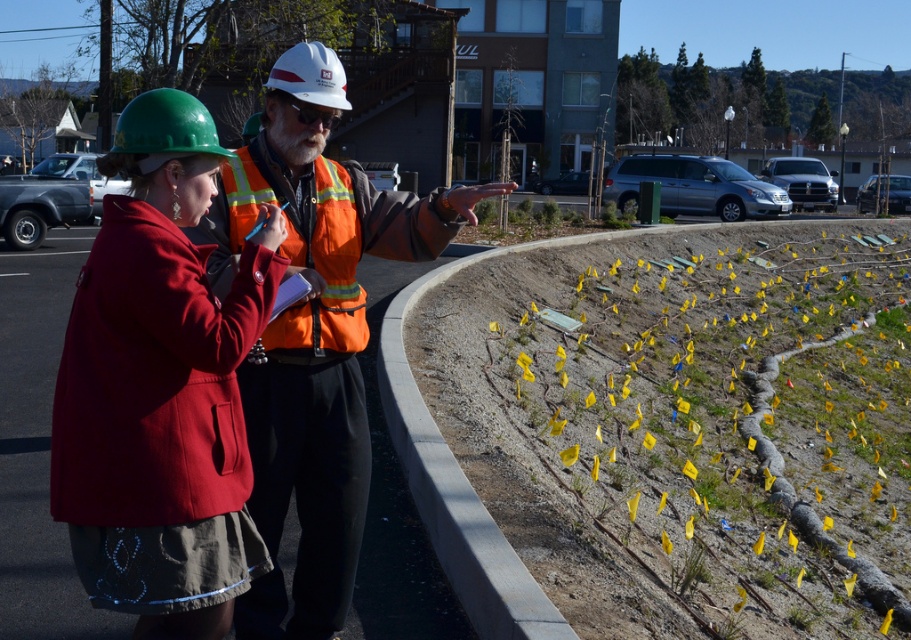
Which is behind, point (487, 394) or point (336, 289)?

The point (487, 394) is more distant.

Looking at this image, is yellow paper at upper right in front of reflective orange safety vest at center?

No, it is behind reflective orange safety vest at center.

Between point (695, 317) and point (467, 192), which one is positioned behind?

Positioned behind is point (695, 317).

Identify the location of yellow paper at upper right. The width and height of the screenshot is (911, 640). (724, 419).

Does reflective orange safety vest at center appear on the right side of orange reflective safety vest at center?

Correct, you'll find reflective orange safety vest at center to the right of orange reflective safety vest at center.

Is point (396, 211) closer to camera compared to point (283, 333)?

No, (396, 211) is behind (283, 333).

At what (x,y) coordinates should I click in order to perform the action: click on reflective orange safety vest at center. Please return your answer as a coordinate pair (x, y). Looking at the image, I should click on (314, 333).

Is concrete at lower right taller than orange reflective safety vest at center?

No, concrete at lower right is not taller than orange reflective safety vest at center.

What do you see at coordinates (458, 486) in the screenshot?
I see `concrete at lower right` at bounding box center [458, 486].

This screenshot has width=911, height=640. Identify the location of concrete at lower right. (458, 486).